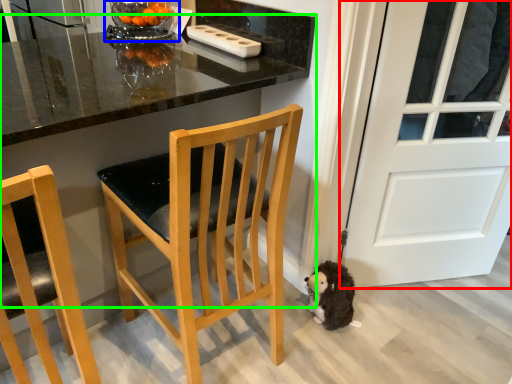
Question: Which object is the closest to the door (highlighted by a red box)? Choose among these: glass bowl (highlighted by a blue box) or table (highlighted by a green box).

Choices:
 (A) glass bowl
 (B) table

Answer: (B)